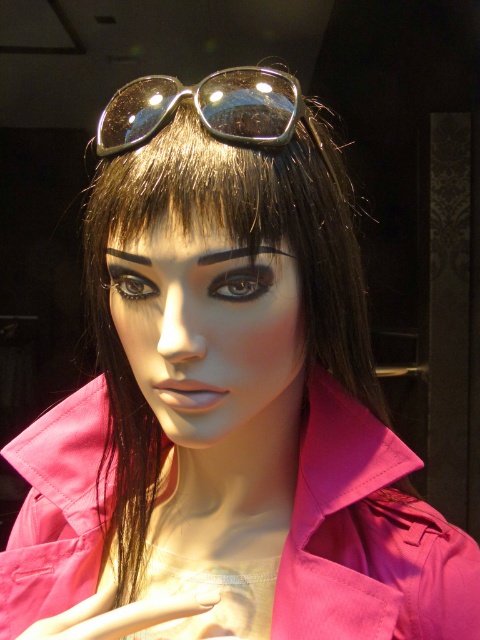
You are a fashion designer trying to adjust the placement of accessories on a mannequin head. You have the shiny black goggles at upper center and the black matte eyebrow at center. Based on their positions, which accessory is positioned higher on the mannequin head?

The shiny black goggles at upper center is much taller than the black matte eyebrow at center, so the shiny black goggles at upper center is positioned higher on the mannequin head.

You are a photographer setting up a shot of the mannequin head. You need to ensure that the smooth matte face at center is in focus. If your camera has a depth of field of 10 inches, will the face be in focus?

The smooth matte face at center is 12.59 inches away from the camera. Since the depth of field is 10 inches, the face is slightly out of the depth of field range, so it may not be in focus. Adjust the camera settings or move closer to ensure sharpness.

You are a fashion designer trying to adjust the placement of accessories on a mannequin head. You have the shiny black goggles at upper center and the black matte eyebrow at upper center. Which accessory is positioned higher on the mannequin head?

The shiny black goggles at upper center is positioned higher on the mannequin head compared to the black matte eyebrow at upper center since it has a greater height.